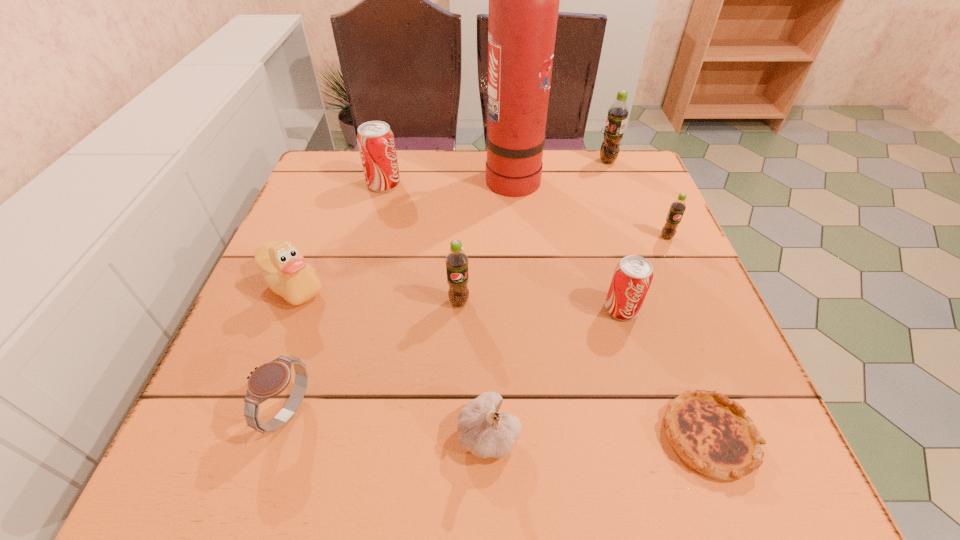
At what (x,y) coordinates should I click in order to perform the action: click on vacant space situated 0.160m on the front label of the second tallest object. Please return your answer as a coordinate pair (x, y). Looking at the image, I should click on (540, 161).

What are the coordinates of `free point located on the front of the farther red soda can` in the screenshot? It's located at (365, 256).

I want to click on vacant region located 0.270m on the front label of the second smallest green soda, so click(452, 449).

Identify the location of free region located 0.240m at the beak of the beige duck. (234, 433).

Find the location of a particular element. free location located 0.120m on the right of the smaller red soda can is located at coordinates (701, 309).

Locate an element on the screen. The height and width of the screenshot is (540, 960). vacant space located on the front label of the rightmost soda is located at coordinates (735, 390).

Where is `free space located 0.220m on the left of the garlic`? The width and height of the screenshot is (960, 540). free space located 0.220m on the left of the garlic is located at coordinates (315, 434).

You are a GUI agent. You are given a task and a screenshot of the screen. Output one action in this format:
    pyautogui.click(x=<x>, y=<y>)
    Task: Click on the vacant space located on the back of the watch
    This screenshot has width=960, height=540.
    Given the screenshot: What is the action you would take?
    pyautogui.click(x=329, y=285)

I want to click on free region located 0.180m on the back of the shortest object, so click(662, 310).

At what (x,y) coordinates should I click in order to perform the action: click on fire extinguisher present at the far edge. Please return your answer as a coordinate pair (x, y). Looking at the image, I should click on (524, 0).